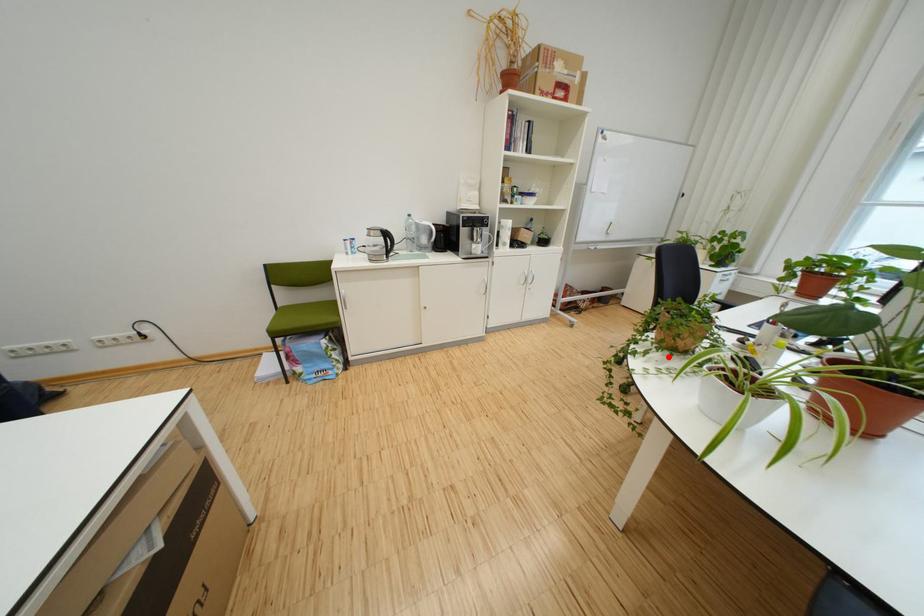
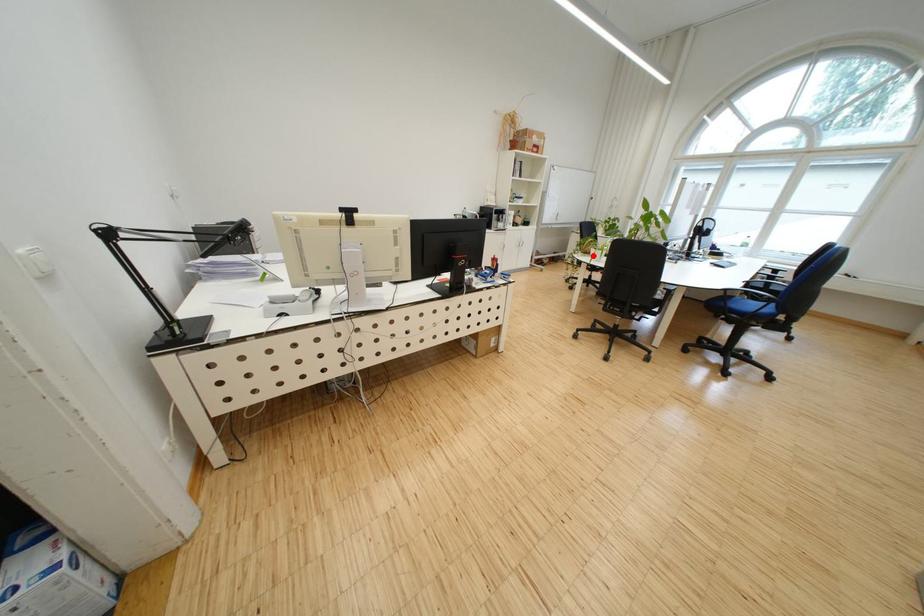
I am providing you with two images of the same scene from different viewpoints. A red point is marked on the first image and another point is marked on the second image. Does the point marked in image1 correspond to the same location as the one in image2?

Yes